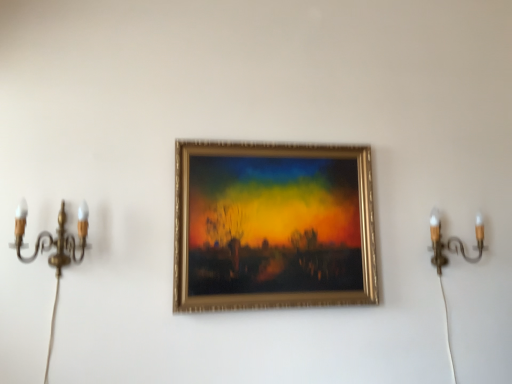
Question: Can you confirm if gold metallic candle holder at right, the 2th candle holder viewed from the front, is taller than gold metallic picture frame at center?

Choices:
 (A) yes
 (B) no

Answer: (B)

Question: Would you say gold metallic picture frame at center is part of gold metallic candle holder at right, the 2th candle holder viewed from the front,'s contents?

Choices:
 (A) yes
 (B) no

Answer: (B)

Question: Can you confirm if gold metallic candle holder at right, which is the 1th candle holder from right to left, is bigger than gold metallic picture frame at center?

Choices:
 (A) yes
 (B) no

Answer: (B)

Question: Is gold metallic candle holder at right, the 2th candle holder viewed from the front, thinner than gold metallic picture frame at center?

Choices:
 (A) yes
 (B) no

Answer: (B)

Question: From a real-world perspective, is gold metallic candle holder at right, the 2th candle holder viewed from the front, physically below gold metallic picture frame at center?

Choices:
 (A) yes
 (B) no

Answer: (A)

Question: Is gold metallic candle holder at right, the 2th candle holder viewed from the front, at the right side of gold metallic picture frame at center?

Choices:
 (A) yes
 (B) no

Answer: (A)

Question: From the image's perspective, is gold brass candle holder at left, arranged as the 1th candle holder when viewed from the left, located beneath gold metallic picture frame at center?

Choices:
 (A) yes
 (B) no

Answer: (A)

Question: Are gold brass candle holder at left, which is counted as the first candle holder, starting from the front, and gold metallic picture frame at center located far from each other?

Choices:
 (A) yes
 (B) no

Answer: (B)

Question: Is gold brass candle holder at left, which is counted as the first candle holder, starting from the front, positioned behind gold metallic picture frame at center?

Choices:
 (A) no
 (B) yes

Answer: (A)

Question: Is gold metallic picture frame at center completely or partially inside gold brass candle holder at left, which is counted as the first candle holder, starting from the front?

Choices:
 (A) no
 (B) yes

Answer: (A)

Question: Could you tell me if gold brass candle holder at left, the second candle holder positioned from the back, is turned towards gold metallic picture frame at center?

Choices:
 (A) no
 (B) yes

Answer: (A)

Question: Is gold brass candle holder at left, which is counted as the first candle holder, starting from the front, thinner than gold metallic picture frame at center?

Choices:
 (A) no
 (B) yes

Answer: (A)

Question: Considering the relative positions of gold metallic picture frame at center and gold brass candle holder at left, arranged as the 1th candle holder when viewed from the left, in the image provided, is gold metallic picture frame at center to the right of gold brass candle holder at left, arranged as the 1th candle holder when viewed from the left, from the viewer's perspective?

Choices:
 (A) yes
 (B) no

Answer: (A)